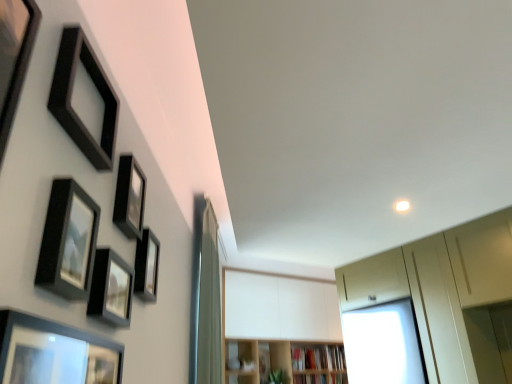
What do you see at coordinates (205, 298) in the screenshot?
I see `silky white curtain at center` at bounding box center [205, 298].

This screenshot has width=512, height=384. What do you see at coordinates (71, 94) in the screenshot?
I see `black matte picture frame at upper left, which appears as the 3th picture frame when viewed from the front` at bounding box center [71, 94].

Image resolution: width=512 pixels, height=384 pixels. What do you see at coordinates (111, 289) in the screenshot?
I see `matte black picture frame at upper left, acting as the third picture frame starting from the back` at bounding box center [111, 289].

What do you see at coordinates (147, 266) in the screenshot? I see `matte black picture frame at center-left, positioned as the sixth picture frame in front-to-back order` at bounding box center [147, 266].

Measure the distance between point (339, 367) and camera.

Point (339, 367) and camera are 13.79 feet apart from each other.

You are a GUI agent. You are given a task and a screenshot of the screen. Output one action in this format:
    pyautogui.click(x=<x>, y=<y>)
    Task: Click on the silky white curtain at center
    The height and width of the screenshot is (384, 512).
    Given the screenshot: What is the action you would take?
    pyautogui.click(x=205, y=298)

Is matte black picture frame at upper left, marked as the 4th picture frame in a front-to-back arrangement, further to camera compared to light wood bookshelf at center, which appears as the 1th shelf when viewed from the left?

No, it is not.

From the image's perspective, would you say matte black picture frame at upper left, marked as the 4th picture frame in a front-to-back arrangement, is positioned over light wood bookshelf at center, which appears as the 1th shelf when viewed from the left?

Correct, matte black picture frame at upper left, marked as the 4th picture frame in a front-to-back arrangement, appears higher than light wood bookshelf at center, which appears as the 1th shelf when viewed from the left, in the image.

Find the location of a particular element. Image resolution: width=512 pixels, height=384 pixels. the 1st shelf behind the matte black picture frame at upper left, acting as the third picture frame starting from the back is located at coordinates (286, 362).

From a real-world perspective, is matte black picture frame at upper left, acting as the third picture frame starting from the back, above or below light wood bookshelf at center, acting as the 2th shelf starting from the right?

In terms of real-world spatial position, matte black picture frame at upper left, acting as the third picture frame starting from the back, is above light wood bookshelf at center, acting as the 2th shelf starting from the right.

Choose the correct answer: Is silky white curtain at center inside matte black picture frame at lower left, the 1th picture frame viewed from the front, or outside it?

silky white curtain at center is spatially situated outside matte black picture frame at lower left, the 1th picture frame viewed from the front.

Is silky white curtain at center positioned far away from matte black picture frame at lower left, the 1th picture frame viewed from the front?

Indeed, silky white curtain at center is not near matte black picture frame at lower left, the 1th picture frame viewed from the front.

Visually, is silky white curtain at center positioned to the left or to the right of matte black picture frame at lower left, the 6th picture frame viewed from the back?

Based on their positions, silky white curtain at center is located to the right of matte black picture frame at lower left, the 6th picture frame viewed from the back.

Is matte black picture frame at upper left, the fifth picture frame from the front, inside matte black picture frame at upper left, marked as the 4th picture frame in a front-to-back arrangement?

No, matte black picture frame at upper left, the fifth picture frame from the front, is not surrounded by matte black picture frame at upper left, marked as the 4th picture frame in a front-to-back arrangement.

Does matte black picture frame at upper left, acting as the third picture frame starting from the back, appear on the left side of matte black picture frame at upper left, which appears as the second picture frame when viewed from the back?

Incorrect, matte black picture frame at upper left, acting as the third picture frame starting from the back, is not on the left side of matte black picture frame at upper left, which appears as the second picture frame when viewed from the back.

From a real-world perspective, count 3rd picture frames upward from the matte black picture frame at upper left, acting as the third picture frame starting from the back, and point to it. Please provide its 2D coordinates.

[(129, 197)]

Does matte black picture frame at upper left, acting as the third picture frame starting from the back, have a lesser height compared to matte black picture frame at upper left, the fifth picture frame from the front?

Correct, matte black picture frame at upper left, acting as the third picture frame starting from the back, is not as tall as matte black picture frame at upper left, the fifth picture frame from the front.

Does matte black picture frame at upper left, which appears as the fifth picture frame when viewed from the back, turn towards light wood bookshelf at center, acting as the 2th shelf starting from the right?

No, matte black picture frame at upper left, which appears as the fifth picture frame when viewed from the back, is not turned towards light wood bookshelf at center, acting as the 2th shelf starting from the right.

Between matte black picture frame at upper left, which appears as the fifth picture frame when viewed from the back, and light wood bookshelf at center, which appears as the 1th shelf when viewed from the left, which one appears on the left side from the viewer's perspective?

From the viewer's perspective, matte black picture frame at upper left, which appears as the fifth picture frame when viewed from the back, appears more on the left side.

Considering the relative sizes of matte black picture frame at upper left, which appears as the fifth picture frame when viewed from the back, and light wood bookshelf at center, which appears as the 1th shelf when viewed from the left, in the image provided, is matte black picture frame at upper left, which appears as the fifth picture frame when viewed from the back, thinner than light wood bookshelf at center, which appears as the 1th shelf when viewed from the left,?

Indeed, matte black picture frame at upper left, which appears as the fifth picture frame when viewed from the back, has a lesser width compared to light wood bookshelf at center, which appears as the 1th shelf when viewed from the left.

Looking at this image, from a real-world perspective, relative to light wood bookshelf at center, which appears as the 1th shelf when viewed from the left, is matte black picture frame at upper left, the second picture frame viewed from the front, vertically above or below?

In terms of real-world spatial position, matte black picture frame at upper left, the second picture frame viewed from the front, is above light wood bookshelf at center, which appears as the 1th shelf when viewed from the left.

How different are the orientations of wooden bookshelf at lower center, which is the 1th shelf from right to left, and matte black picture frame at lower left, the 6th picture frame viewed from the back, in degrees?

wooden bookshelf at lower center, which is the 1th shelf from right to left, and matte black picture frame at lower left, the 6th picture frame viewed from the back, are facing 56.5 degrees away from each other.

Which object is wider, wooden bookshelf at lower center, which is the 2th shelf in left-to-right order, or matte black picture frame at lower left, the 6th picture frame viewed from the back?

wooden bookshelf at lower center, which is the 2th shelf in left-to-right order.

Does point (296, 364) lie behind point (89, 337)?

Yes, it is.

Locate an element on the screen. This screenshot has width=512, height=384. the 3rd picture frame positioned below the wooden bookshelf at lower center, which is the 1th shelf from right to left (from a real-world perspective) is located at coordinates (54, 353).

How far apart are black matte picture frame at upper left, which appears as the 3th picture frame when viewed from the front, and matte black picture frame at upper left, the fifth picture frame from the front?

9.54 inches.

Can you confirm if black matte picture frame at upper left, which is the fourth picture frame in back-to-front order, is positioned to the right of matte black picture frame at upper left, the fifth picture frame from the front?

In fact, black matte picture frame at upper left, which is the fourth picture frame in back-to-front order, is to the left of matte black picture frame at upper left, the fifth picture frame from the front.

Consider the image. Between black matte picture frame at upper left, which is the fourth picture frame in back-to-front order, and matte black picture frame at upper left, which appears as the second picture frame when viewed from the back, which one has smaller size?

matte black picture frame at upper left, which appears as the second picture frame when viewed from the back, is smaller.

From the image's perspective, is black matte picture frame at upper left, which is the fourth picture frame in back-to-front order, below matte black picture frame at upper left, the fifth picture frame from the front?

Incorrect, from the image's perspective, black matte picture frame at upper left, which is the fourth picture frame in back-to-front order, is higher than matte black picture frame at upper left, the fifth picture frame from the front.

Can you confirm if matte black picture frame at lower left, the 6th picture frame viewed from the back, is taller than black matte picture frame at upper left, which appears as the 3th picture frame when viewed from the front?

No, matte black picture frame at lower left, the 6th picture frame viewed from the back, is not taller than black matte picture frame at upper left, which appears as the 3th picture frame when viewed from the front.

Which is more to the left, matte black picture frame at lower left, the 1th picture frame viewed from the front, or black matte picture frame at upper left, which appears as the 3th picture frame when viewed from the front?

black matte picture frame at upper left, which appears as the 3th picture frame when viewed from the front, is more to the left.

From a real-world perspective, starting from the matte black picture frame at lower left, the 6th picture frame viewed from the back, which picture frame is the 5th one vertically above it? Please provide its 2D coordinates.

[(71, 94)]

The width and height of the screenshot is (512, 384). What are the coordinates of `shelf that is the 1st object located below the matte black picture frame at upper left, marked as the 4th picture frame in a front-to-back arrangement (from the image's perspective)` in the screenshot? It's located at (286, 362).

There is a silky white curtain at center. At what (x,y) coordinates should I click in order to perform the action: click on the 1st picture frame above it (from the image's perspective). Please return your answer as a coordinate pair (x, y). Looking at the image, I should click on (54, 353).

Considering their positions, is black matte picture frame at upper left, which appears as the 3th picture frame when viewed from the front, positioned closer to matte black picture frame at upper left, acting as the third picture frame starting from the back, than matte black picture frame at lower left, the 6th picture frame viewed from the back?

matte black picture frame at lower left, the 6th picture frame viewed from the back.

When comparing their distances from matte black picture frame at center-left, arranged as the 1th picture frame when viewed from the back, does wooden bookshelf at lower center, which is the 1th shelf from right to left, or matte black picture frame at upper left, which appears as the fifth picture frame when viewed from the back, seem closer?

Among the two, matte black picture frame at upper left, which appears as the fifth picture frame when viewed from the back, is located nearer to matte black picture frame at center-left, arranged as the 1th picture frame when viewed from the back.

Looking at the image, which one is located further to matte black picture frame at upper left, which appears as the second picture frame when viewed from the back, matte black picture frame at lower left, the 6th picture frame viewed from the back, or matte white cabinet at upper right?

matte white cabinet at upper right lies further to matte black picture frame at upper left, which appears as the second picture frame when viewed from the back, than the other object.

Which object lies further to the anchor point matte black picture frame at upper left, marked as the 4th picture frame in a front-to-back arrangement, matte black picture frame at upper left, the second picture frame viewed from the front, or light wood bookshelf at center, acting as the 2th shelf starting from the right?

light wood bookshelf at center, acting as the 2th shelf starting from the right.

Considering their positions, is wooden bookshelf at lower center, which is the 2th shelf in left-to-right order, positioned closer to matte white cabinet at upper right than silky white curtain at center?

silky white curtain at center is positioned closer to the anchor matte white cabinet at upper right.

Looking at this image, looking at the image, which one is located further to silky white curtain at center, wooden bookshelf at lower center, which is the 2th shelf in left-to-right order, or matte black picture frame at upper left, acting as the third picture frame starting from the back?

wooden bookshelf at lower center, which is the 2th shelf in left-to-right order.

Considering their positions, is matte black picture frame at upper left, which appears as the second picture frame when viewed from the back, positioned further to wooden bookshelf at lower center, which is the 2th shelf in left-to-right order, than matte black picture frame at upper left, which appears as the fifth picture frame when viewed from the back?

matte black picture frame at upper left, which appears as the fifth picture frame when viewed from the back, is positioned further to the anchor wooden bookshelf at lower center, which is the 2th shelf in left-to-right order.

Which object lies nearer to the anchor point wooden bookshelf at lower center, which is the 1th shelf from right to left, matte black picture frame at upper left, the second picture frame viewed from the front, or black matte picture frame at upper left, which is the fourth picture frame in back-to-front order?

matte black picture frame at upper left, the second picture frame viewed from the front.

Where is `curtain situated between matte black picture frame at upper left, which appears as the fifth picture frame when viewed from the back, and matte white cabinet at upper right from left to right`? This screenshot has height=384, width=512. curtain situated between matte black picture frame at upper left, which appears as the fifth picture frame when viewed from the back, and matte white cabinet at upper right from left to right is located at coordinates (205, 298).

Locate an element on the screen. curtain between matte black picture frame at upper left, the fifth picture frame from the front, and light wood bookshelf at center, acting as the 2th shelf starting from the right, along the z-axis is located at coordinates (205, 298).

Image resolution: width=512 pixels, height=384 pixels. I want to click on picture frame positioned between matte black picture frame at upper left, marked as the 4th picture frame in a front-to-back arrangement, and matte black picture frame at center-left, positioned as the sixth picture frame in front-to-back order, from near to far, so click(129, 197).

This screenshot has height=384, width=512. I want to click on cabinetry between matte black picture frame at upper left, the fifth picture frame from the front, and light wood bookshelf at center, acting as the 2th shelf starting from the right, from front to back, so click(x=446, y=295).